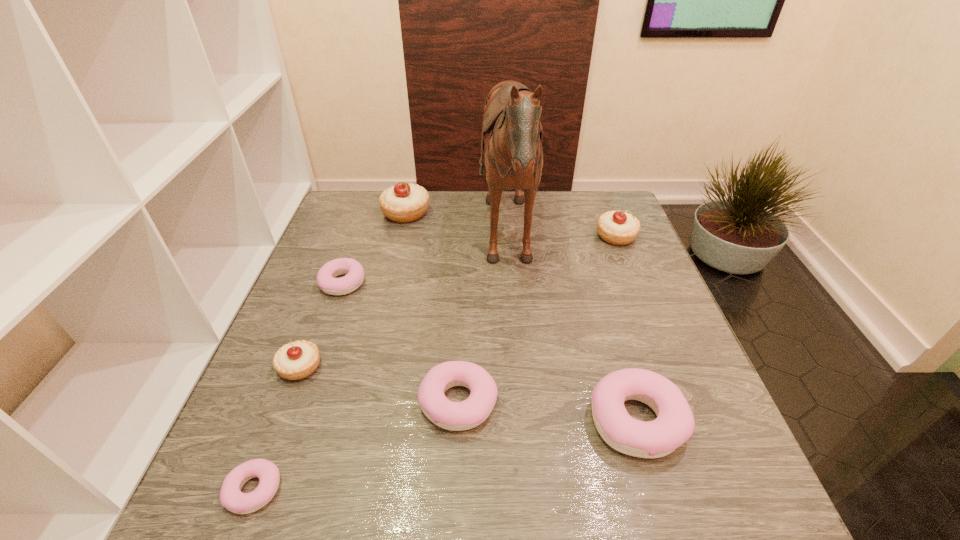
Locate an element on the screen. free spot located 0.220m on the right of the leftmost beige pastry is located at coordinates (427, 367).

Locate an element on the screen. Image resolution: width=960 pixels, height=540 pixels. free region located 0.210m on the left of the rightmost pink pastry is located at coordinates (477, 421).

Where is `free spot located on the right of the third shortest pastry`? The width and height of the screenshot is (960, 540). free spot located on the right of the third shortest pastry is located at coordinates [616, 402].

The height and width of the screenshot is (540, 960). Identify the location of free space located on the back of the fifth nearest pastry. (361, 231).

Find the location of a particular element. The width and height of the screenshot is (960, 540). vacant space located 0.170m on the back of the shortest pastry is located at coordinates (295, 383).

Locate an element on the screen. saddle that is at the far edge is located at coordinates (x=512, y=132).

The width and height of the screenshot is (960, 540). What are the coordinates of `object present at the near edge` in the screenshot? It's located at [231, 497].

Identify the location of object present at the far left corner. (403, 203).

Identify the location of object that is at the near left corner. (231, 497).

The image size is (960, 540). I want to click on object positioned at the far right corner, so click(x=619, y=228).